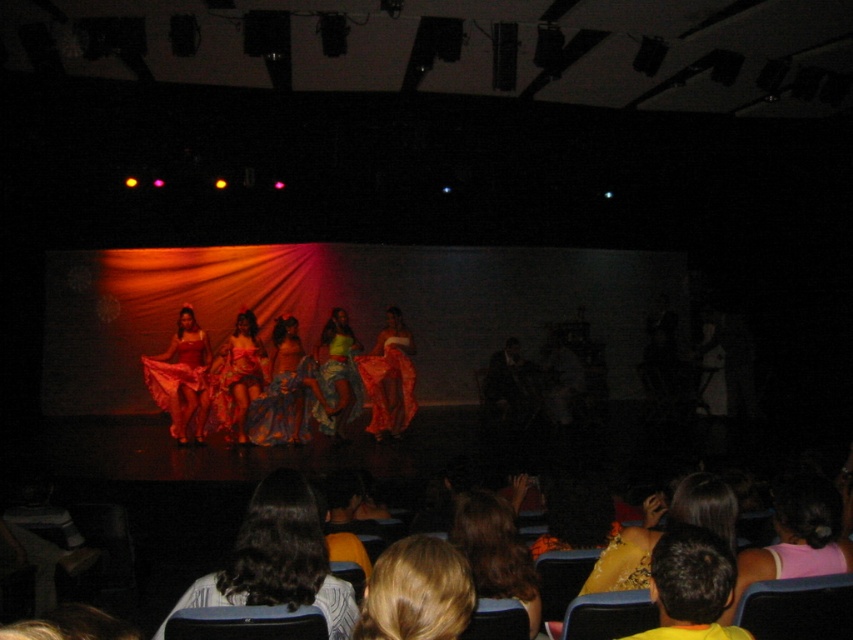
You are an audience member sitting in the theater. You notice two items in the scene, the yellow fabric at lower right and the fluffy white sweater at lower center. Which item is narrower?

The yellow fabric at lower right is narrower than the fluffy white sweater at lower center.

You are a photographer standing at the back of the theater. You want to capture a photo of both the shiny red dress at center and the shiny yellow dress at center in the same frame. The minimum distance between the two dresses that allows both to be in focus is 4 feet. Can you take the photo without moving your position?

The shiny red dress at center is 3.82 feet from the shiny yellow dress at center. Since 3.82 feet is less than the required 4 feet minimum distance for both to be in focus, you can take the photo without moving your position as the distance is sufficient.

You are a photographer in the audience trying to capture the performers on stage. You notice the shiny satin dress at center and the shiny orange fabric at center. Which object would appear larger in your photo?

The shiny satin dress at center would appear larger in the photo because it is closer to the viewer than the shiny orange fabric at center.